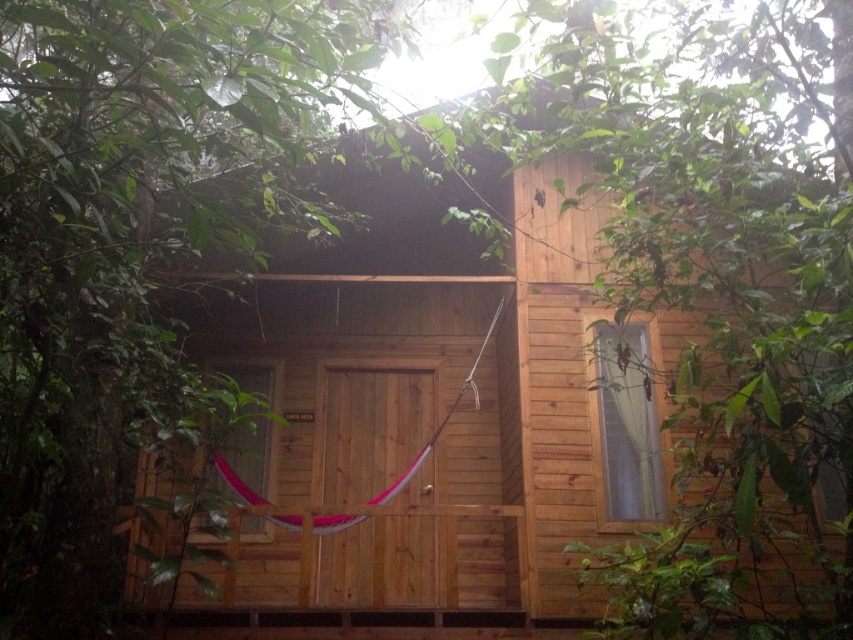
Question: Does natural wood cabin at center appear under green wood tree at center?

Choices:
 (A) no
 (B) yes

Answer: (B)

Question: Which object appears farthest from the camera in this image?

Choices:
 (A) natural wood cabin at center
 (B) green wood tree at center

Answer: (A)

Question: Which of the following is the farthest from the observer?

Choices:
 (A) natural wood cabin at center
 (B) green wood tree at center

Answer: (A)

Question: Does natural wood cabin at center lie in front of green wood tree at center?

Choices:
 (A) yes
 (B) no

Answer: (B)

Question: Which point is farther to the camera?

Choices:
 (A) natural wood cabin at center
 (B) green wood tree at center

Answer: (A)

Question: Can you confirm if natural wood cabin at center is positioned to the left of green wood tree at center?

Choices:
 (A) yes
 (B) no

Answer: (B)